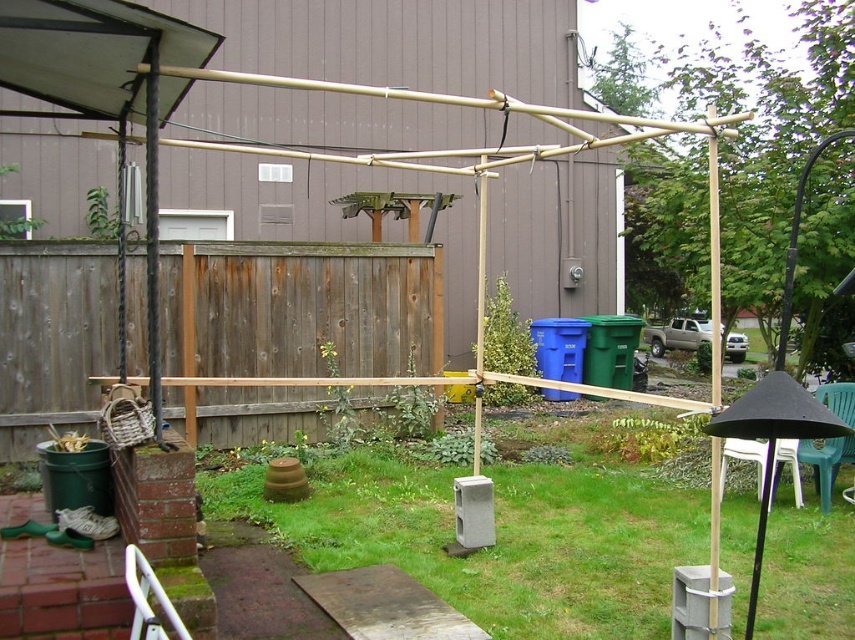
Question: Does wooden fence at center lie behind green plastic chair at lower right?

Choices:
 (A) no
 (B) yes

Answer: (B)

Question: Among these objects, which one is nearest to the camera?

Choices:
 (A) green plastic chair at lower right
 (B) wooden fence at center

Answer: (A)

Question: Can you confirm if green grass at center is positioned below wooden fence at center?

Choices:
 (A) no
 (B) yes

Answer: (B)

Question: Which of the following is the closest to the observer?

Choices:
 (A) (578, 616)
 (B) (853, 451)

Answer: (A)

Question: Can you confirm if wooden fence at center is thinner than green plastic chair at lower right?

Choices:
 (A) yes
 (B) no

Answer: (B)

Question: Which object is positioned closest to the white plastic chair at lower right?

Choices:
 (A) green grass at center
 (B) wooden fence at center
 (C) green plastic chair at lower right

Answer: (C)